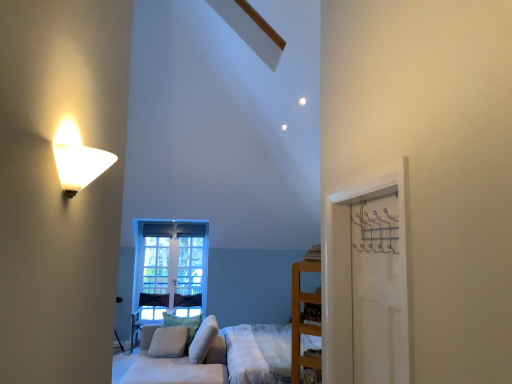
Question: Can you confirm if wooden bed frame at lower center is taller than wooden shelf at right?

Choices:
 (A) yes
 (B) no

Answer: (A)

Question: Would you consider wooden bed frame at lower center to be distant from wooden shelf at right?

Choices:
 (A) yes
 (B) no

Answer: (A)

Question: Can you confirm if wooden bed frame at lower center is bigger than wooden shelf at right?

Choices:
 (A) yes
 (B) no

Answer: (A)

Question: Is wooden bed frame at lower center positioned with its back to wooden shelf at right?

Choices:
 (A) no
 (B) yes

Answer: (A)

Question: Could you tell me if wooden bed frame at lower center is facing wooden shelf at right?

Choices:
 (A) yes
 (B) no

Answer: (B)

Question: Is metallic silver hanger at right to the left or to the right of white soft pillow at center, which is the second pillow from right to left, in the image?

Choices:
 (A) left
 (B) right

Answer: (B)

Question: From the image's perspective, is metallic silver hanger at right located above or below white soft pillow at center, which is the second pillow from right to left?

Choices:
 (A) below
 (B) above

Answer: (B)

Question: Is point (393, 221) positioned closer to the camera than point (198, 324)?

Choices:
 (A) farther
 (B) closer

Answer: (B)

Question: Looking at the image, does metallic silver hanger at right seem bigger or smaller compared to white soft pillow at center, positioned as the second pillow in left-to-right order?

Choices:
 (A) big
 (B) small

Answer: (B)

Question: In the image, is white soft pillow at center, positioned as the second pillow in left-to-right order, on the left side or the right side of wooden shelf at right?

Choices:
 (A) right
 (B) left

Answer: (B)

Question: Is point (186, 349) closer or farther from the camera than point (290, 380)?

Choices:
 (A) farther
 (B) closer

Answer: (A)

Question: Looking at the image, does white soft pillow at center, positioned as the second pillow in left-to-right order, seem bigger or smaller compared to wooden shelf at right?

Choices:
 (A) small
 (B) big

Answer: (B)

Question: Considering their positions, is white soft pillow at center, positioned as the second pillow in left-to-right order, located in front of or behind wooden shelf at right?

Choices:
 (A) behind
 (B) front

Answer: (A)

Question: Is metallic silver hanger at right bigger or smaller than white matte door at right?

Choices:
 (A) big
 (B) small

Answer: (B)

Question: Considering their positions, is metallic silver hanger at right located in front of or behind white matte door at right?

Choices:
 (A) front
 (B) behind

Answer: (B)